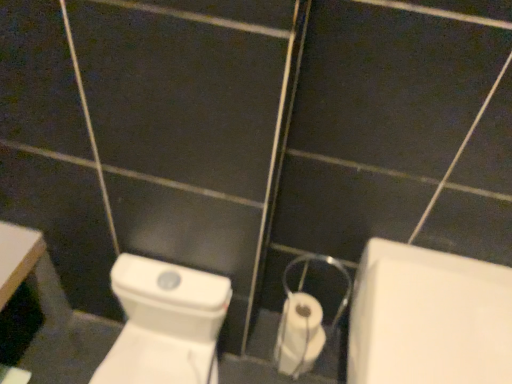
I want to click on white glossy bath at lower right, so click(x=428, y=318).

From the image's perspective, is white glossy bath at lower right located above or below white glossy toilet at center?

From the image's perspective, white glossy bath at lower right appears below white glossy toilet at center.

Which is less distant, (383, 357) or (168, 370)?

Point (383, 357) is closer to the camera than point (168, 370).

Is white glossy bath at lower right turned away from white glossy toilet at center?

That's not correct — white glossy bath at lower right is not looking away from white glossy toilet at center.

Identify the location of bath above the white glossy toilet at center (from a real-world perspective). The image size is (512, 384). click(x=428, y=318).

From the image's perspective, is white glossy toilet at center beneath white glossy bath at lower right?

Incorrect, from the image's perspective, white glossy toilet at center is higher than white glossy bath at lower right.

Looking at this image, is white glossy toilet at center to the right of white glossy bath at lower right from the viewer's perspective?

No.

Considering the relative sizes of white glossy toilet at center and white glossy bath at lower right in the image provided, is white glossy toilet at center wider than white glossy bath at lower right?

Incorrect, the width of white glossy toilet at center does not surpass that of white glossy bath at lower right.

Consider the image. From a real-world perspective, who is located higher, white glossy toilet at center or white glossy bath at lower right?

white glossy bath at lower right, from a real-world perspective.

Considering the sizes of objects white plastic toilet paper at center and white glossy bath at lower right in the image provided, who is bigger, white plastic toilet paper at center or white glossy bath at lower right?

With larger size is white glossy bath at lower right.

Is there a large distance between white plastic toilet paper at center and white glossy bath at lower right?

That's not correct — white plastic toilet paper at center is a little close to white glossy bath at lower right.

This screenshot has height=384, width=512. In the image, there is a white glossy bath at lower right. Find the location of `dispenser above it (from the image's perspective)`. dispenser above it (from the image's perspective) is located at coordinates (305, 322).

Does white plastic toilet paper at center come in front of white glossy bath at lower right?

No, the depth of white plastic toilet paper at center is greater than that of white glossy bath at lower right.

Is white glossy toilet at center at the left side of white plastic toilet paper at center?

Yes.

Between white glossy toilet at center and white plastic toilet paper at center, which one has less height?

white plastic toilet paper at center.

Does white glossy toilet at center contain white plastic toilet paper at center?

No, white plastic toilet paper at center is not a part of white glossy toilet at center.

Measure the distance between white glossy toilet at center and white plastic toilet paper at center.

Answer: 10.98 inches.

Is white plastic toilet paper at center surrounding white glossy toilet at center?

No.

From the image's perspective, is white plastic toilet paper at center below white glossy toilet at center?

No, from the image's perspective, white plastic toilet paper at center is not beneath white glossy toilet at center.

Does white plastic toilet paper at center come behind white glossy toilet at center?

Yes, it is.

Considering the relative sizes of white plastic toilet paper at center and white glossy toilet at center in the image provided, is white plastic toilet paper at center bigger than white glossy toilet at center?

Incorrect, white plastic toilet paper at center is not larger than white glossy toilet at center.

From the image's perspective, which is above, white glossy bath at lower right or white plastic toilet paper at center?

white plastic toilet paper at center.

In the image, there is a white glossy bath at lower right. Where is `dispenser above it (from the image's perspective)`? This screenshot has height=384, width=512. dispenser above it (from the image's perspective) is located at coordinates (305, 322).

Which object is more forward, white glossy bath at lower right or white plastic toilet paper at center?

Positioned in front is white glossy bath at lower right.

Is white glossy bath at lower right placed right next to white plastic toilet paper at center?

No, white glossy bath at lower right is not making contact with white plastic toilet paper at center.

You are a GUI agent. You are given a task and a screenshot of the screen. Output one action in this format:
    pyautogui.click(x=<x>, y=<y>)
    Task: Click on the toilet above the white glossy bath at lower right (from the image's perspective)
    Image resolution: width=512 pixels, height=384 pixels.
    Given the screenshot: What is the action you would take?
    [165, 324]

The image size is (512, 384). I want to click on bath in front of the white glossy toilet at center, so click(x=428, y=318).

From the image, which object appears to be farther from white glossy bath at lower right, white glossy toilet at center or white plastic toilet paper at center?

white glossy toilet at center is further to white glossy bath at lower right.

Consider the image. Looking at the image, which one is located closer to white plastic toilet paper at center, white glossy toilet at center or white glossy bath at lower right?

white glossy bath at lower right is positioned closer to the anchor white plastic toilet paper at center.

When comparing their distances from white glossy toilet at center, does white plastic toilet paper at center or white glossy bath at lower right seem closer?

The object closer to white glossy toilet at center is white plastic toilet paper at center.

From the image, which object appears to be farther from white plastic toilet paper at center, white glossy bath at lower right or white glossy toilet at center?

white glossy toilet at center is positioned further to the anchor white plastic toilet paper at center.

Which object lies nearer to the anchor point white glossy toilet at center, white glossy bath at lower right or white plastic toilet paper at center?

white plastic toilet paper at center.

Considering their positions, is white plastic toilet paper at center positioned closer to white glossy bath at lower right than white glossy toilet at center?

white plastic toilet paper at center is positioned closer to the anchor white glossy bath at lower right.

Where is `dispenser between white glossy toilet at center and white glossy bath at lower right in the horizontal direction`? dispenser between white glossy toilet at center and white glossy bath at lower right in the horizontal direction is located at coordinates (305, 322).